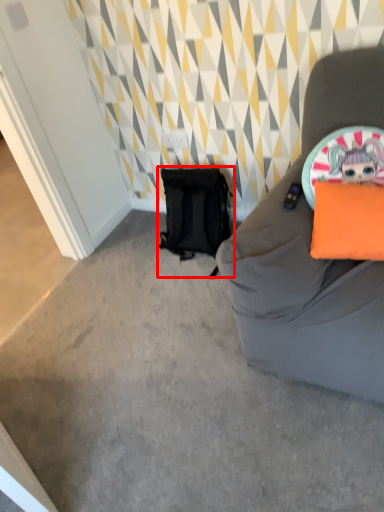
Question: From the image's perspective, considering the relative positions of backpack (annotated by the red box) and pillow in the image provided, where is backpack (annotated by the red box) located with respect to the staircase?

Choices:
 (A) above
 (B) below

Answer: (A)